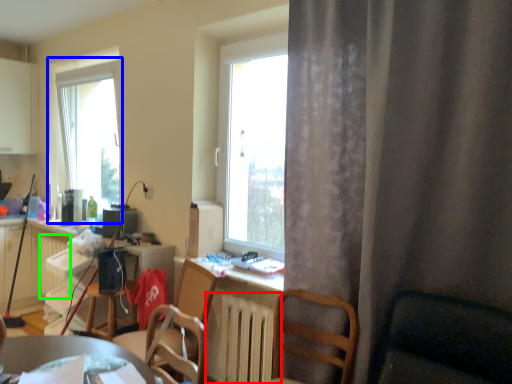
Question: Based on their relative distances, which object is farther from radiator (highlighted by a red box)? Choose from window (highlighted by a blue box) and radiator (highlighted by a green box).

Choices:
 (A) window
 (B) radiator

Answer: (A)